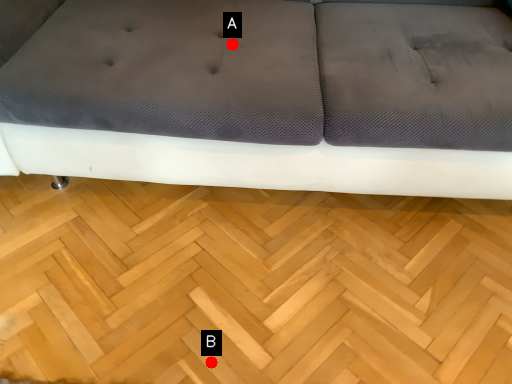
Question: Two points are circled on the image, labeled by A and B beside each circle. Among these points, which one is farthest from the camera?

Choices:
 (A) A is further
 (B) B is further

Answer: (A)